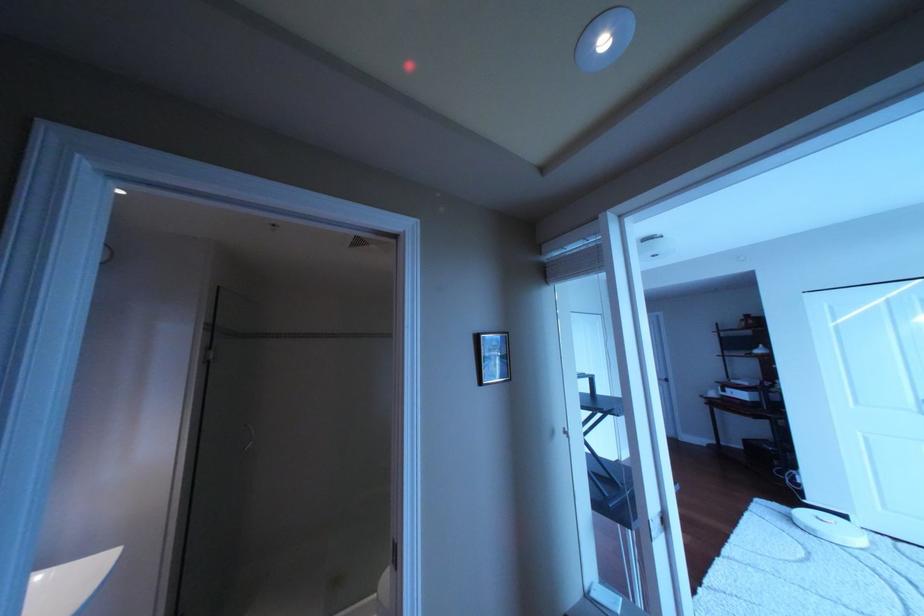
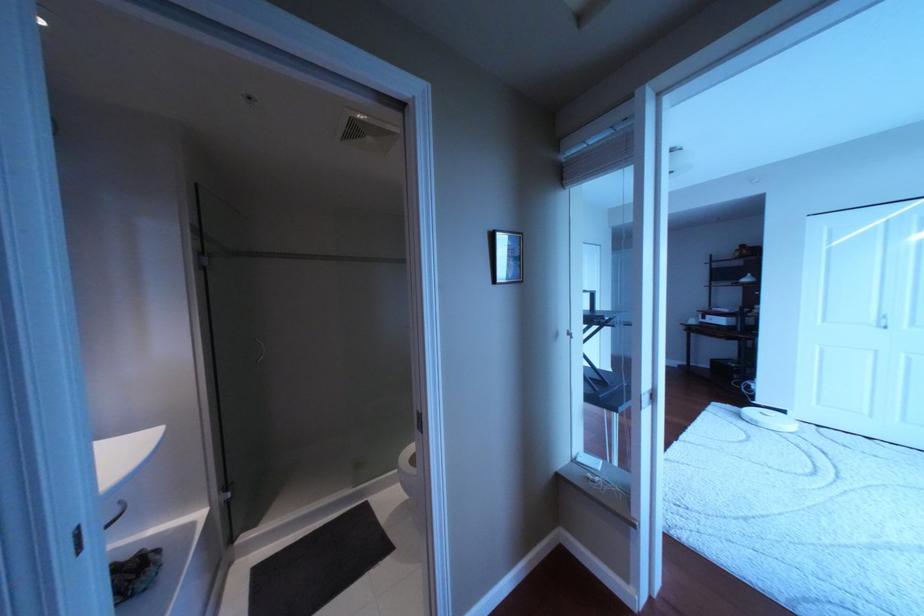
Question: The images are taken continuously from a first-person perspective. In which direction is your viewpoint rotating?

Choices:
 (A) Left
 (B) Right
 (C) Up
 (D) Down

Answer: (D)